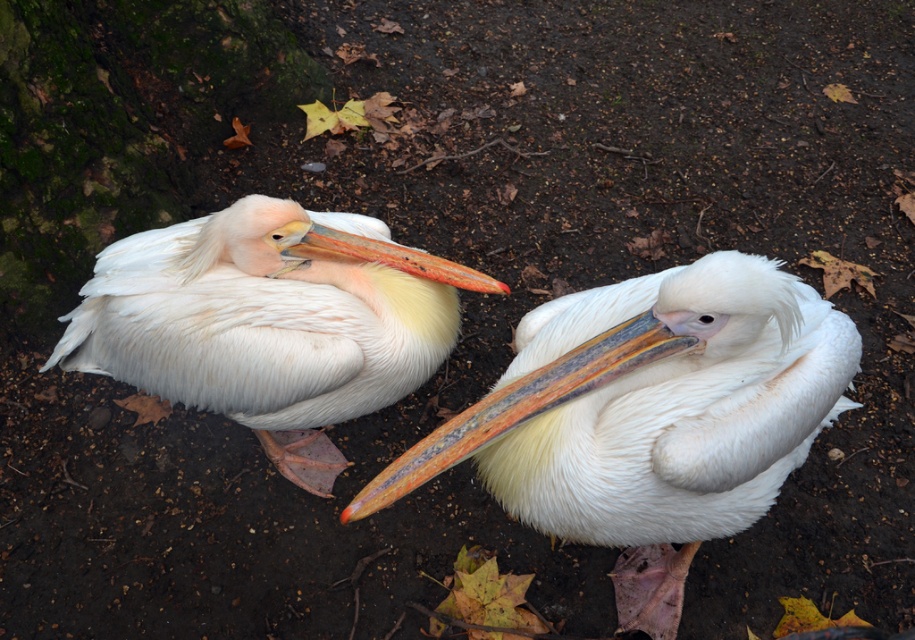
Which is more to the right, white feathered pelican at center or white feathered pelican at left?

From the viewer's perspective, white feathered pelican at center appears more on the right side.

Who is higher up, white feathered pelican at center or white feathered pelican at left?

white feathered pelican at left is higher up.

Image resolution: width=915 pixels, height=640 pixels. Describe the element at coordinates (650, 406) in the screenshot. I see `white feathered pelican at center` at that location.

Where is `white feathered pelican at center`? This screenshot has height=640, width=915. white feathered pelican at center is located at coordinates (650, 406).